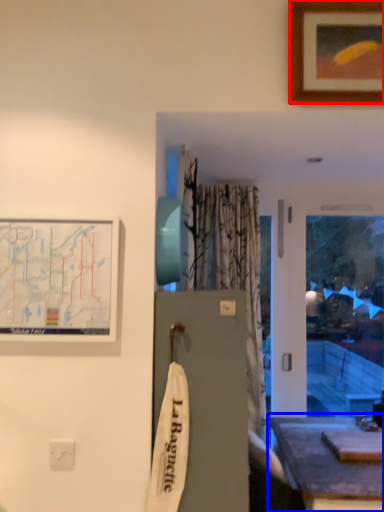
Question: Which object appears closest to the camera in this image, picture frame (highlighted by a red box) or table (highlighted by a blue box)?

Choices:
 (A) picture frame
 (B) table

Answer: (A)